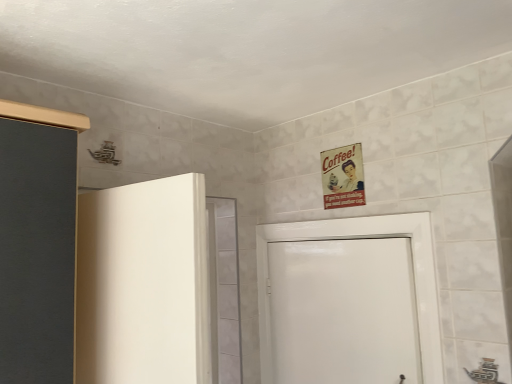
Locate an element on the screen. white glossy door at center is located at coordinates (362, 237).

The height and width of the screenshot is (384, 512). Describe the element at coordinates (362, 237) in the screenshot. I see `white glossy door at center` at that location.

What is the approximate height of white glossy door at center?

It is 28.47 inches.

At what (x,y) coordinates should I click in order to perform the action: click on metallic vintage poster at upper center. Please return your answer as a coordinate pair (x, y). This screenshot has height=384, width=512. Looking at the image, I should click on (343, 177).

The image size is (512, 384). Describe the element at coordinates (343, 177) in the screenshot. I see `metallic vintage poster at upper center` at that location.

Where is `white glossy door at center`? This screenshot has width=512, height=384. white glossy door at center is located at coordinates (362, 237).

Is metallic vintage poster at upper center at the right side of white glossy door at center?

Correct, you'll find metallic vintage poster at upper center to the right of white glossy door at center.

Considering the positions of objects metallic vintage poster at upper center and white glossy door at center in the image provided, who is behind, metallic vintage poster at upper center or white glossy door at center?

metallic vintage poster at upper center is more distant.

Is point (362, 187) closer or farther from the camera than point (262, 345)?

Point (362, 187) is positioned closer to the camera compared to point (262, 345).

From the image's perspective, between metallic vintage poster at upper center and white glossy door at center, who is located below?

white glossy door at center, from the image's perspective.

From a real-world perspective, who is located lower, metallic vintage poster at upper center or white glossy door at center?

white glossy door at center.

Does metallic vintage poster at upper center have a greater width compared to white glossy door at center?

No.

From the picture: From their relative heights in the image, would you say metallic vintage poster at upper center is taller or shorter than white glossy door at center?

Considering their sizes, metallic vintage poster at upper center has less height than white glossy door at center.

Which of these two, metallic vintage poster at upper center or white glossy door at center, is bigger?

white glossy door at center.

Can white glossy door at center be found inside metallic vintage poster at upper center?

No, white glossy door at center is not surrounded by metallic vintage poster at upper center.

Are metallic vintage poster at upper center and white glossy door at center making contact?

metallic vintage poster at upper center and white glossy door at center are clearly separated.

Is metallic vintage poster at upper center aimed at white glossy door at center?

No, metallic vintage poster at upper center is not aimed at white glossy door at center.

Identify the location of poster that is above the white glossy door at center (from the image's perspective). The image size is (512, 384). (343, 177).

Based on their positions, is white glossy door at center located to the left or right of metallic vintage poster at upper center?

From the image, it's evident that white glossy door at center is to the left of metallic vintage poster at upper center.

Is white glossy door at center in front of or behind metallic vintage poster at upper center in the image?

white glossy door at center is positioned closer to the viewer than metallic vintage poster at upper center.

Between point (422, 238) and point (336, 171), which one is positioned in front?

The point (422, 238) is closer.

From the image's perspective, would you say white glossy door at center is positioned over metallic vintage poster at upper center?

Actually, white glossy door at center appears below metallic vintage poster at upper center in the image.

From a real-world perspective, between white glossy door at center and metallic vintage poster at upper center, who is vertically higher?

metallic vintage poster at upper center.

Considering the sizes of objects white glossy door at center and metallic vintage poster at upper center in the image provided, who is wider, white glossy door at center or metallic vintage poster at upper center?

Wider between the two is white glossy door at center.

Between white glossy door at center and metallic vintage poster at upper center, which one has less height?

metallic vintage poster at upper center.

Between white glossy door at center and metallic vintage poster at upper center, which one has larger size?

white glossy door at center.

Can we say white glossy door at center lies outside metallic vintage poster at upper center?

That's correct, white glossy door at center is outside of metallic vintage poster at upper center.

Is white glossy door at center next to metallic vintage poster at upper center and touching it?

No, white glossy door at center is not touching metallic vintage poster at upper center.

Could you tell me if white glossy door at center is turned towards metallic vintage poster at upper center?

No.

Locate an element on the screen. The image size is (512, 384). door on the left of metallic vintage poster at upper center is located at coordinates (362, 237).

Locate an element on the screen. The image size is (512, 384). poster that appears on the right of white glossy door at center is located at coordinates (343, 177).

What are the coordinates of `poster above the white glossy door at center (from the image's perspective)` in the screenshot? It's located at (343, 177).